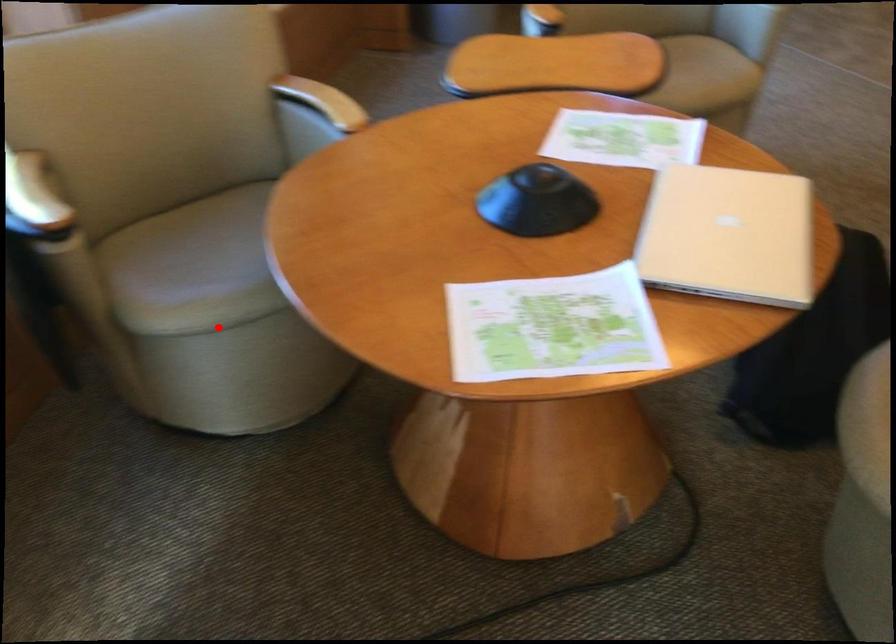
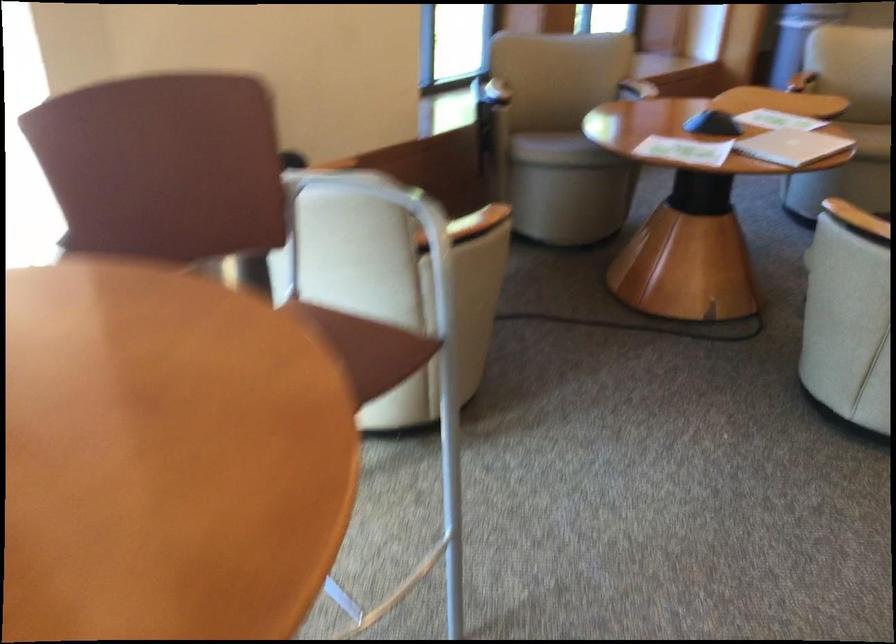
Where in the second image is the point corresponding to the highlighted location from the first image?

(561, 149)